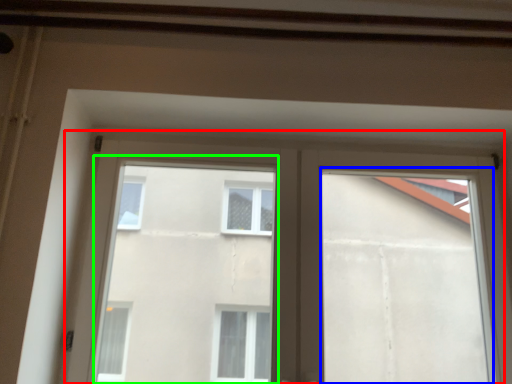
Question: Which is nearer to the window (highlighted by a red box)? window frame (highlighted by a blue box) or bay window (highlighted by a green box).

Choices:
 (A) window frame
 (B) bay window

Answer: (A)